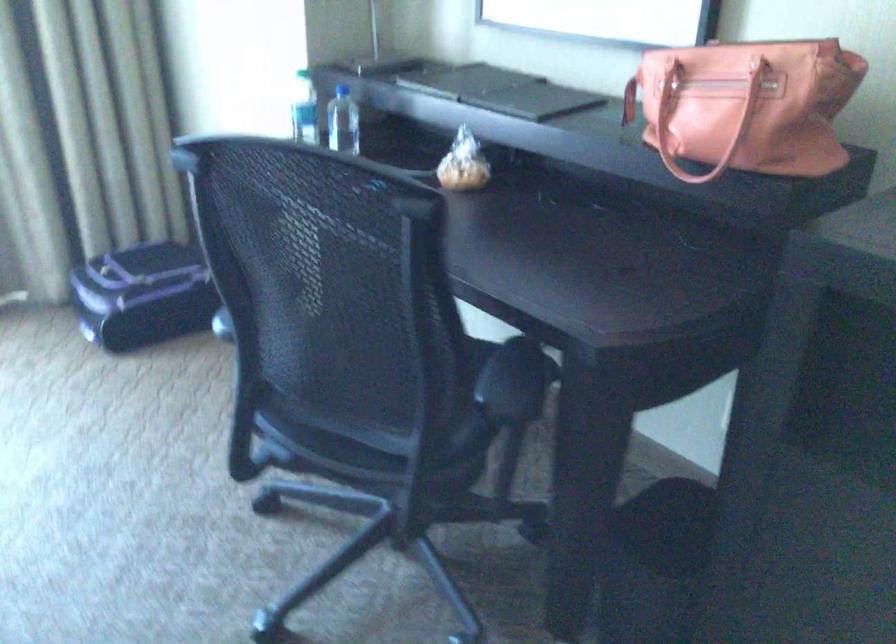
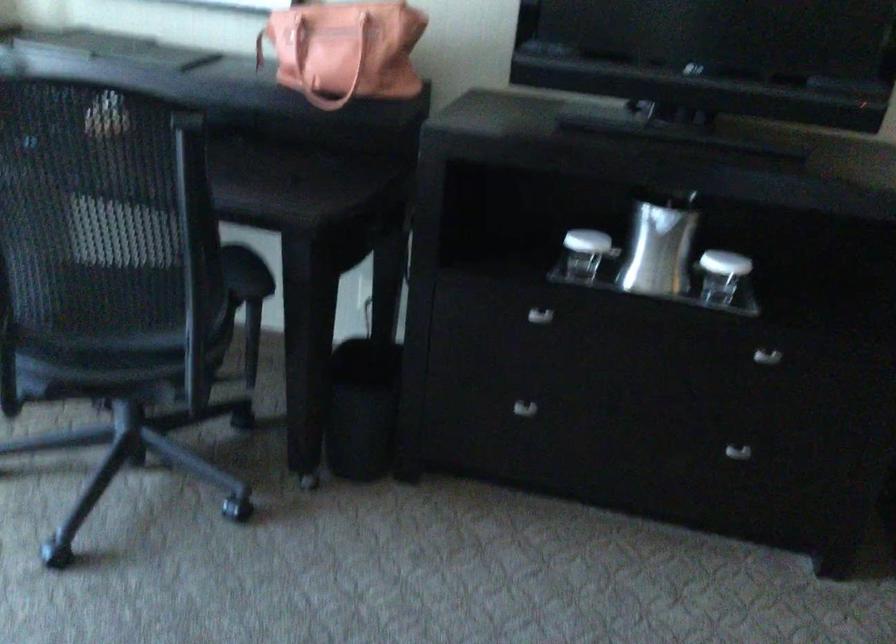
Locate, in the second image, the point that corresponds to the point at 348,346 in the first image.

(107, 265)